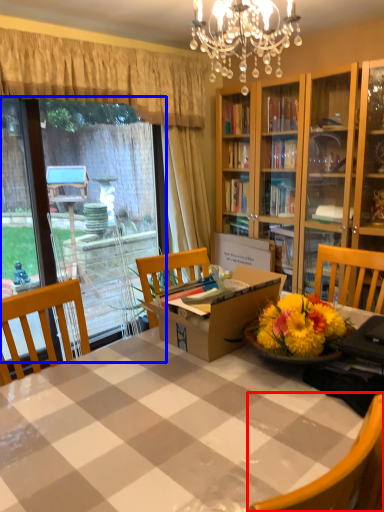
Question: Which object appears farthest to the camera in this image, chair (highlighted by a red box) or glass door (highlighted by a blue box)?

Choices:
 (A) chair
 (B) glass door

Answer: (B)